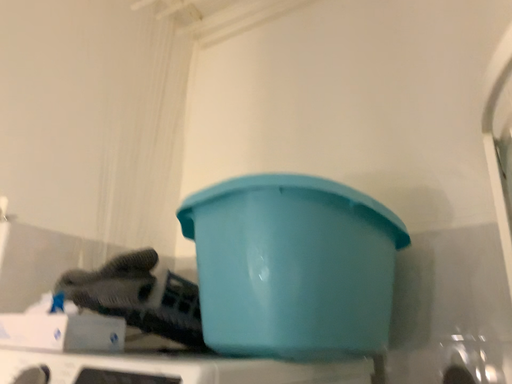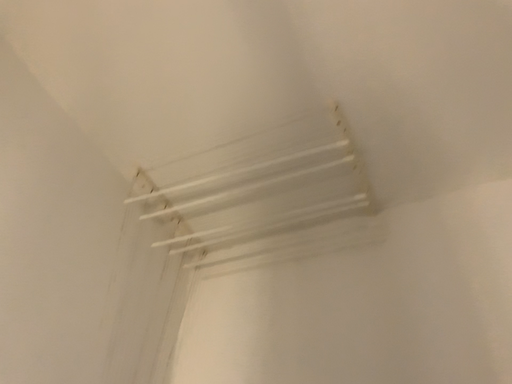
Question: How did the camera likely rotate when shooting the video?

Choices:
 (A) rotated left
 (B) rotated right

Answer: (B)